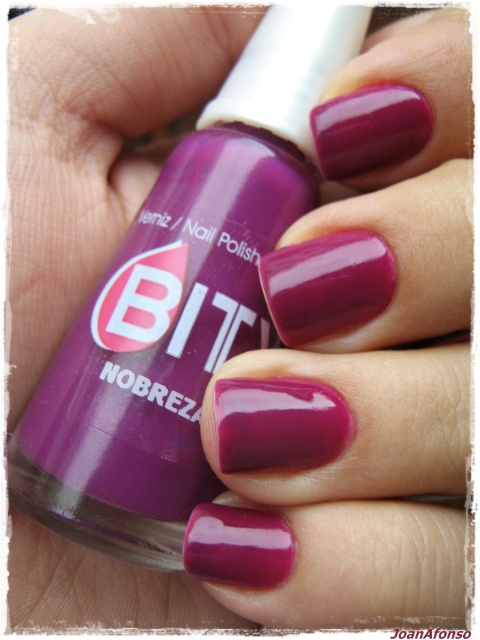
Question: Is matte purple nail polish at center above satin purple nail polish at center?

Choices:
 (A) yes
 (B) no

Answer: (A)

Question: Among these objects, which one is nearest to the camera?

Choices:
 (A) glossy nail polish at center
 (B) matte purple nail polish at center
 (C) satin purple nail polish at center

Answer: (A)

Question: Is glossy nail polish at center closer to camera compared to matte purple nail polish at center?

Choices:
 (A) no
 (B) yes

Answer: (B)

Question: Can you confirm if glossy nail polish at center is wider than matte purple nail polish at center?

Choices:
 (A) no
 (B) yes

Answer: (A)

Question: Which of the following is the farthest from the observer?

Choices:
 (A) (405, 550)
 (B) (173, 156)

Answer: (B)

Question: Among these points, which one is nearest to the camera?

Choices:
 (A) (214, 563)
 (B) (369, 184)
 (C) (34, 408)

Answer: (A)